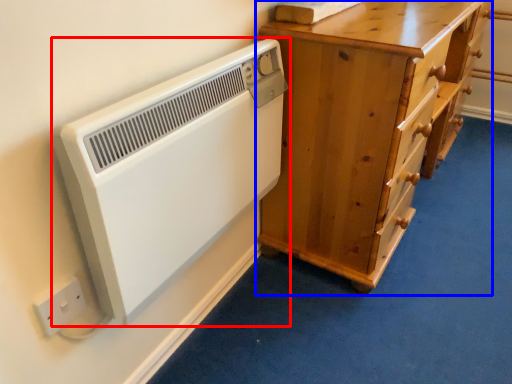
Question: Which object appears closest to the camera in this image, home appliance (highlighted by a red box) or chest of drawers (highlighted by a blue box)?

Choices:
 (A) home appliance
 (B) chest of drawers

Answer: (A)